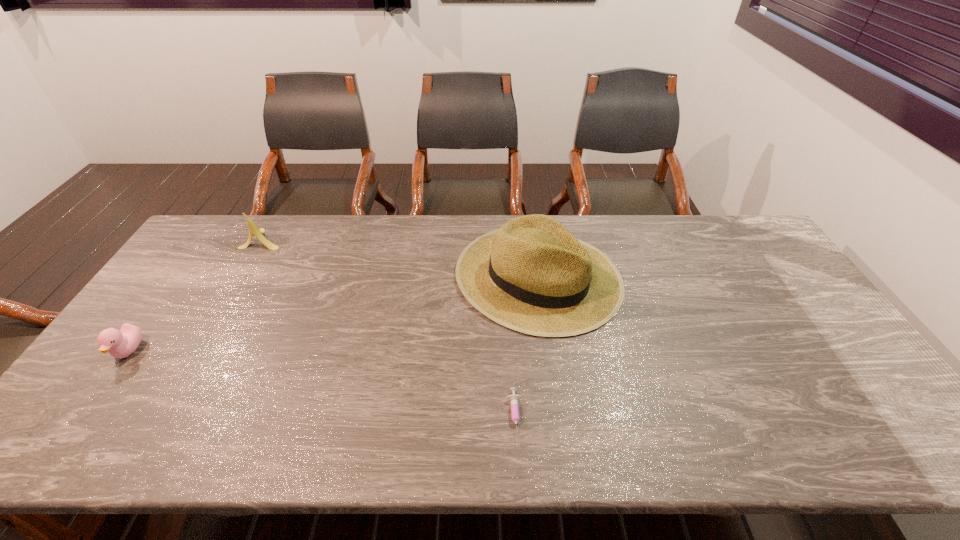
Identify which object is the second closest to the syringe. Please provide its 2D coordinates. Your answer should be formatted as a tuple, i.e. [(x, y)], where the tuple contains the x and y coordinates of a point satisfying the conditions above.

[(253, 229)]

Locate which object is the closest to the nearest object. Please provide its 2D coordinates. Your answer should be formatted as a tuple, i.e. [(x, y)], where the tuple contains the x and y coordinates of a point satisfying the conditions above.

[(532, 275)]

Locate an element on the screen. free spot that satisfies the following two spatial constraints: 1. on the front-facing side of the shortest object; 2. on the left side of the leftmost object is located at coordinates (81, 418).

The height and width of the screenshot is (540, 960). Find the location of `vacant space that satisfies the following two spatial constraints: 1. on the front-facing side of the syringe; 2. on the right side of the leftmost object`. vacant space that satisfies the following two spatial constraints: 1. on the front-facing side of the syringe; 2. on the right side of the leftmost object is located at coordinates (81, 418).

The height and width of the screenshot is (540, 960). Identify the location of free spot that satisfies the following two spatial constraints: 1. on the back side of the nearest object; 2. on the right side of the tallest object. (506, 277).

Image resolution: width=960 pixels, height=540 pixels. I want to click on vacant space that satisfies the following two spatial constraints: 1. on the front-facing side of the second shortest object; 2. on the left side of the syringe, so click(x=81, y=418).

Where is `vacant region that satisfies the following two spatial constraints: 1. on the front-facing side of the duckling; 2. on the right side of the shortest object`? vacant region that satisfies the following two spatial constraints: 1. on the front-facing side of the duckling; 2. on the right side of the shortest object is located at coordinates pos(81,418).